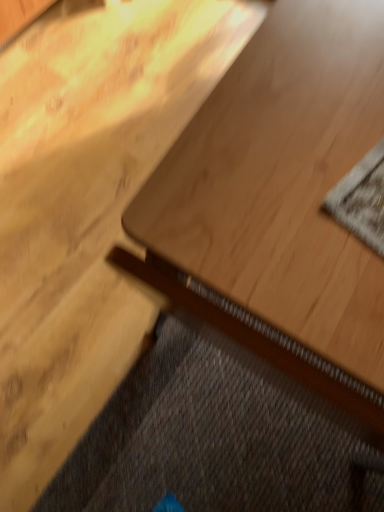
The image size is (384, 512). Find the location of `free location above dark gray textured doormat at lower left (from a real-world perspective)`. free location above dark gray textured doormat at lower left (from a real-world perspective) is located at coordinates (196, 458).